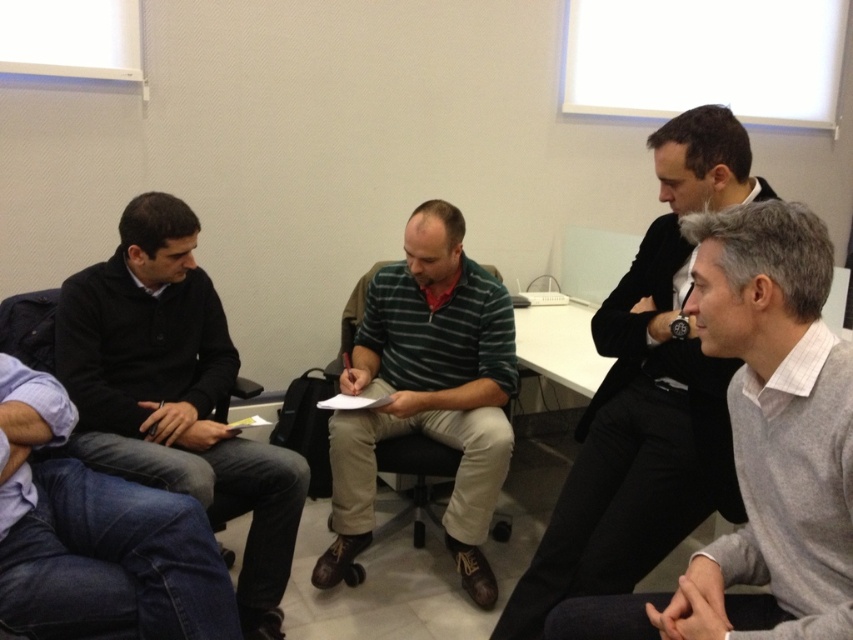
You are organizing a charity event and need to decide which sweater to donate based on size. If the dark gray sweater at left is larger than the green striped sweater at center, which one should you choose if you want to donate the bigger one?

The dark gray sweater at left is bigger than the green striped sweater at center, so you should choose the dark gray sweater at left for donation since it is the larger one.

You are organizing a charity event and need to arrange seating for attendees. The green striped sweater at center and jeans at lower left are part of the donated items. Based on their sizes, which one can comfortably fit on a standard chair seat that measures 45 cm in width?

The green striped sweater at center has a greater width than the jeans at lower left. Since the chair seat is 45 cm wide, the green striped sweater at center may not fit comfortably, but the jeans at lower left, being narrower, should fit better.